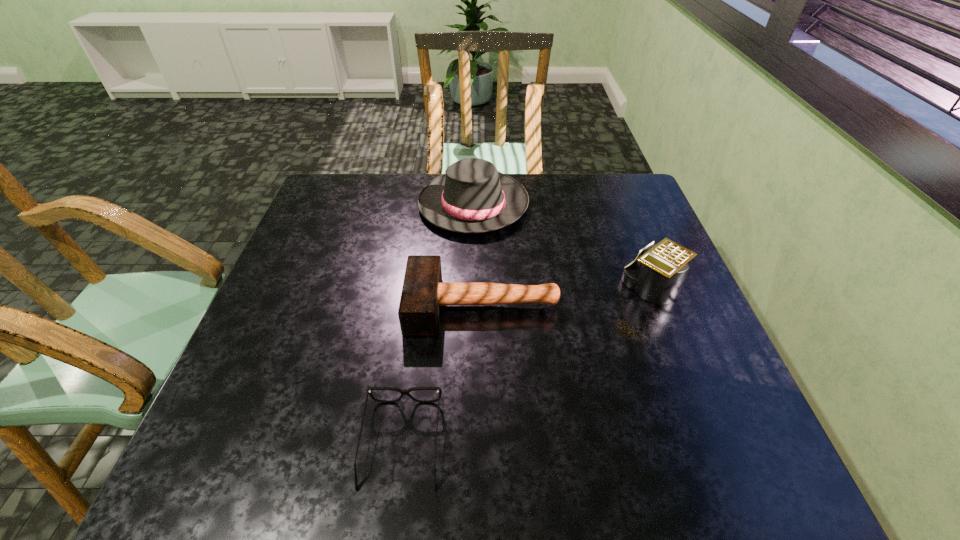
Locate an element on the screen. This screenshot has width=960, height=540. object that is at the far edge is located at coordinates (472, 197).

The image size is (960, 540). I want to click on object that is at the near edge, so click(403, 392).

The image size is (960, 540). Identify the location of object at the right edge. (657, 277).

In order to click on free space at the far edge in this screenshot , I will do `click(539, 189)`.

Locate an element on the screen. vacant space at the near edge of the desktop is located at coordinates (636, 492).

This screenshot has width=960, height=540. Find the location of `vacant space at the left edge of the desktop`. vacant space at the left edge of the desktop is located at coordinates (313, 312).

What are the coordinates of `vacant position at the far left corner of the desktop` in the screenshot? It's located at (370, 180).

Image resolution: width=960 pixels, height=540 pixels. Find the location of `vacant space at the far right corner of the desktop`. vacant space at the far right corner of the desktop is located at coordinates (622, 188).

You are a GUI agent. You are given a task and a screenshot of the screen. Output one action in this format:
    pyautogui.click(x=<x>, y=<y>)
    Task: Click on the vacant space at the near right corner of the desktop
    
    Given the screenshot: What is the action you would take?
    pyautogui.click(x=710, y=469)

Image resolution: width=960 pixels, height=540 pixels. Find the location of `vacant area that lies between the third tallest object and the spectacles`. vacant area that lies between the third tallest object and the spectacles is located at coordinates (443, 374).